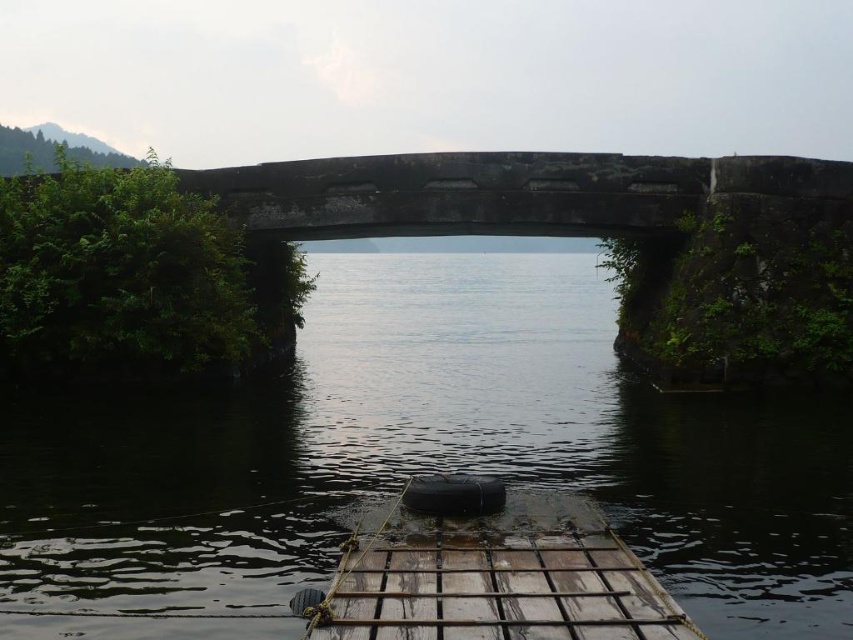
You are standing on the stone bridge and see two boats floating on the water below. Which boat is closer to the left side of the bridge? The black rubber boat at center or the wooden planks boat at center?

The black rubber boat at center is positioned on the left side of wooden planks boat at center, so it is closer to the left side of the bridge.

You are standing on the stone bridge and want to place a small potted plant on the black rubber boat at center. Based on the coordinates provided, can you determine if the boat is positioned directly under the bridge or slightly offset to one side?

The black rubber boat at center is located at point (428, 456). Since the coordinates are not exactly 0.5 in both axes, the boat is slightly offset to the right and forward from the center of the bridge, so it is not directly under the center point of the bridge.

You are standing on the stone bridge and see both the black rubber boat at center and the wooden planks boat at center in the water below. Which boat is closer to the bridge?

The black rubber boat at center is closer to the bridge because it is positioned above the wooden planks boat at center, meaning it is nearer to the bridge structure.